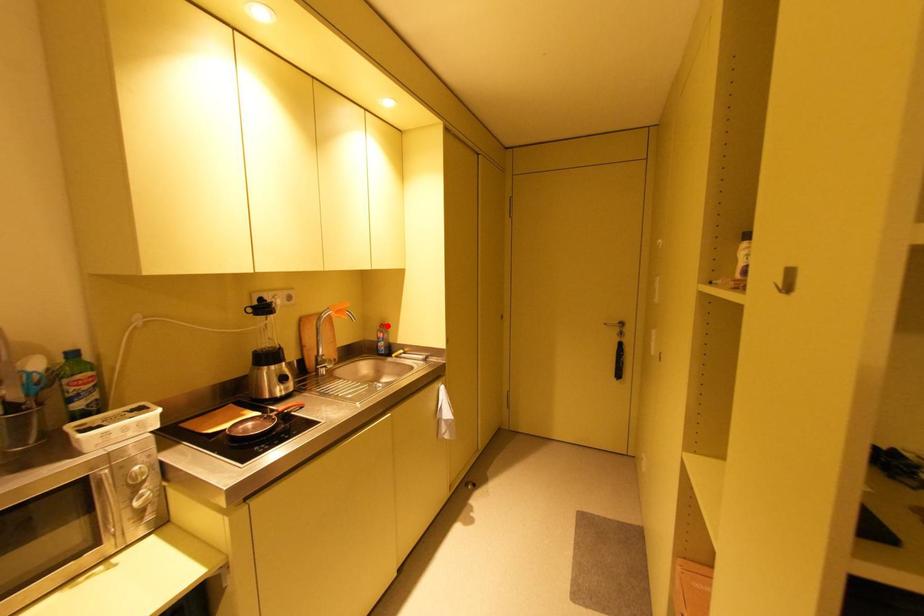
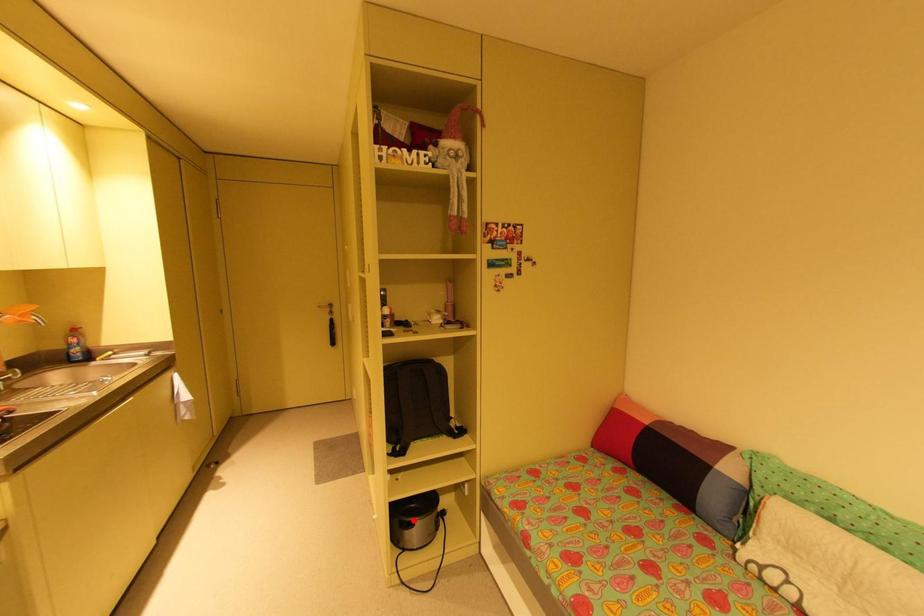
I am providing you with two images of the same scene from different viewpoints. A red point is marked on the first image and another point is marked on the second image. Is the marked point in image1 the same physical position as the marked point in image2?

No